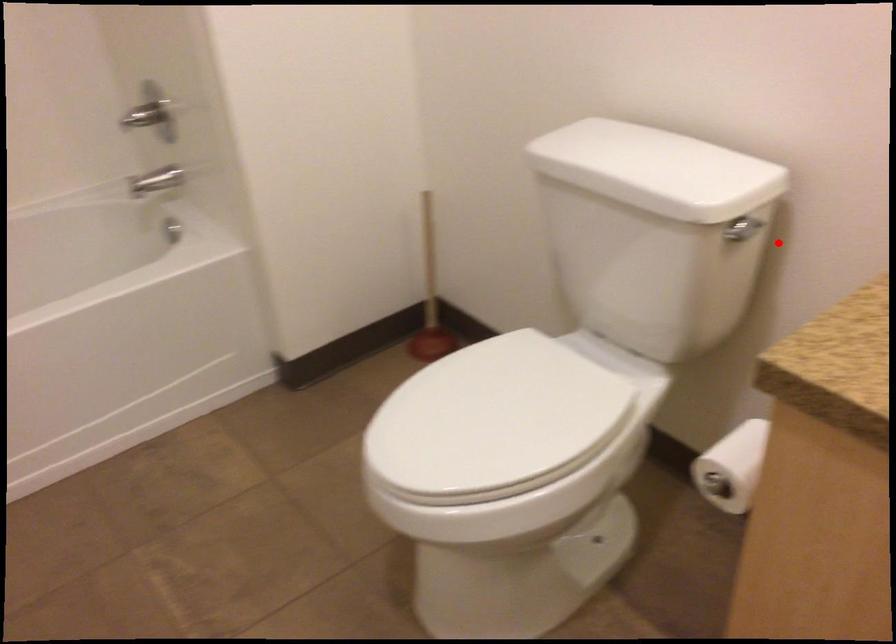
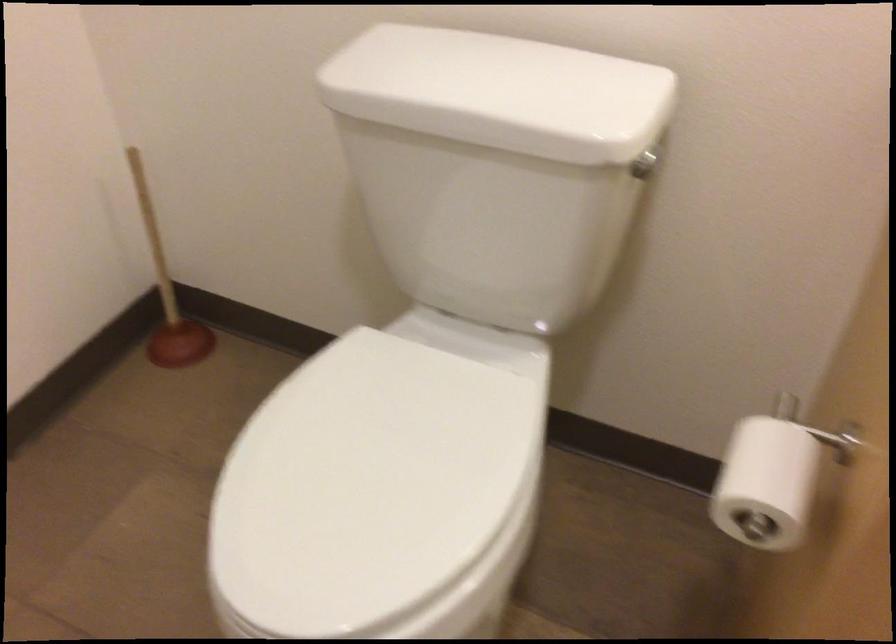
Question: I am providing you with two images of the same scene from different viewpoints. Given a red point in image1, look at the same physical point in image2. Is it:

Choices:
 (A) Closer to the viewpoint
 (B) Farther from the viewpoint

Answer: (A)